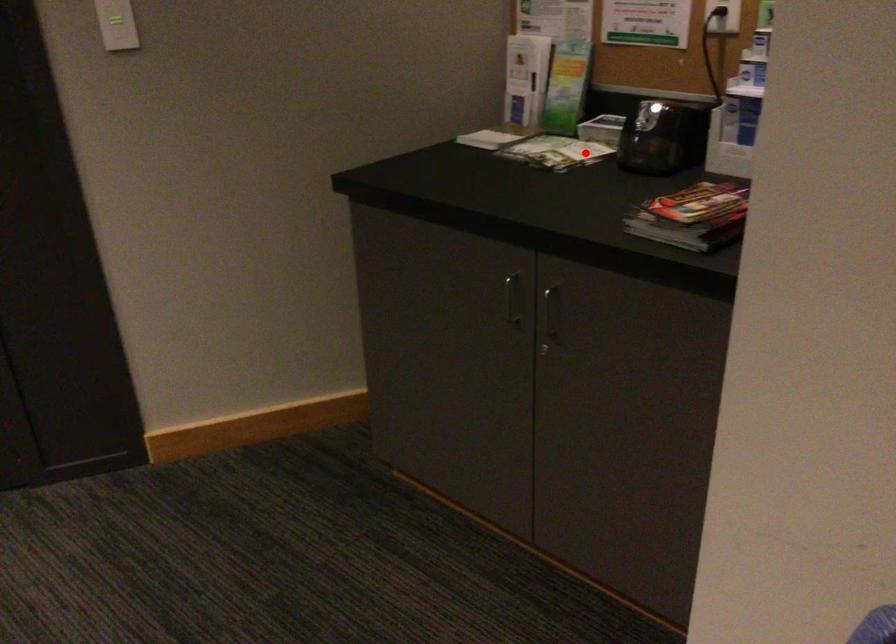
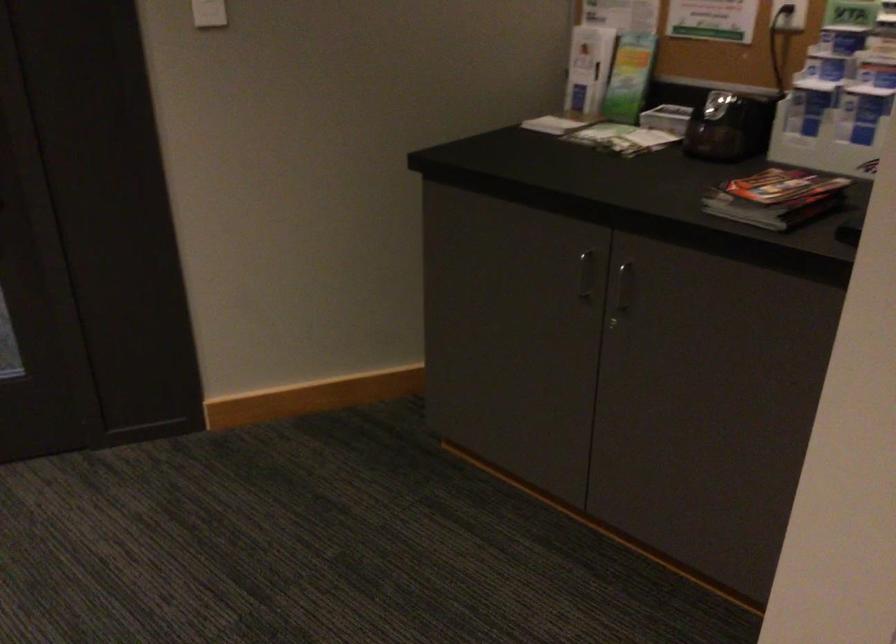
Question: I am providing you with two images of the same scene from different viewpoints. A red point is marked on the first image. Is the red point's position out of view in image 2?

Choices:
 (A) Yes
 (B) No

Answer: (B)